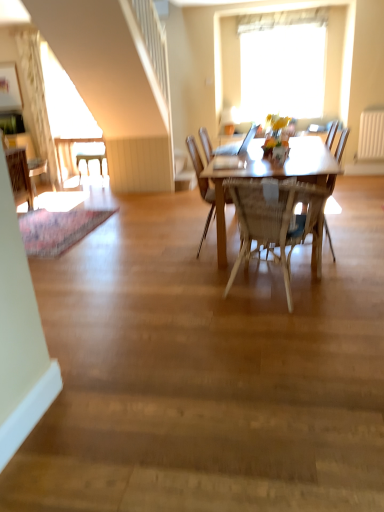
The width and height of the screenshot is (384, 512). I want to click on vacant space behind matte white vase at center, so click(290, 158).